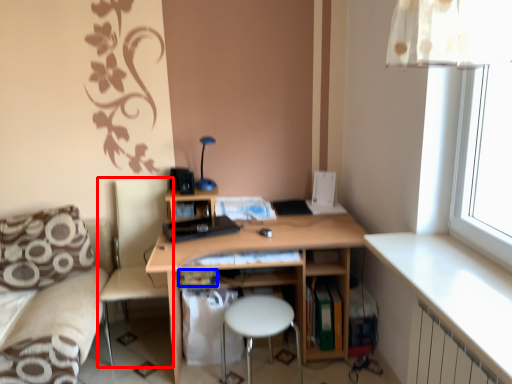
Question: Which of the following is the farthest to the observer, swivel chair (highlighted by a red box) or book (highlighted by a blue box)?

Choices:
 (A) swivel chair
 (B) book

Answer: (B)